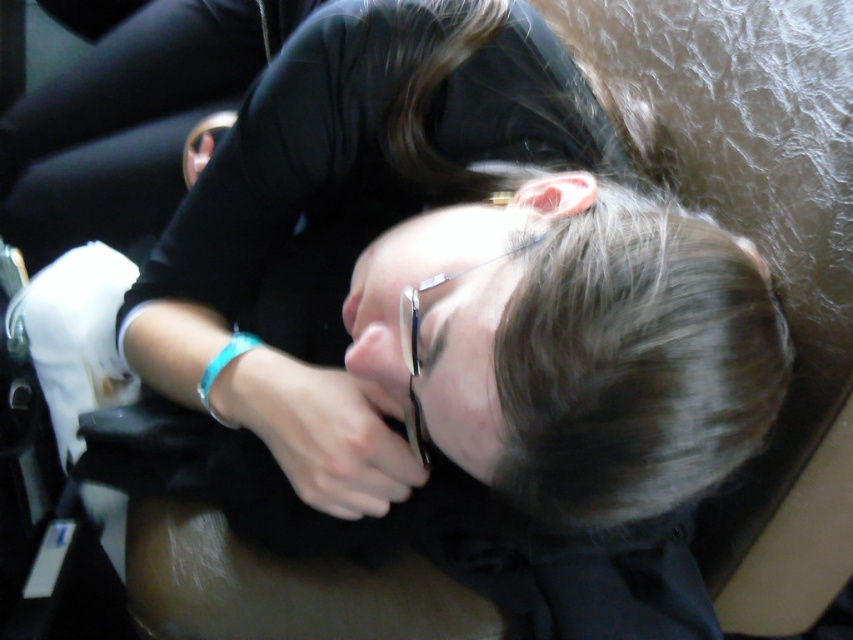
Does smooth skin hand at center come in front of turquoise plastic bracelet at lower center?

Yes, smooth skin hand at center is in front of turquoise plastic bracelet at lower center.

Can you confirm if smooth skin hand at center is thinner than turquoise plastic bracelet at lower center?

In fact, smooth skin hand at center might be wider than turquoise plastic bracelet at lower center.

Locate an element on the screen. This screenshot has height=640, width=853. smooth skin hand at center is located at coordinates (320, 432).

Can you confirm if dark brown silky hair at center is positioned to the right of smooth skin hand at center?

Indeed, dark brown silky hair at center is positioned on the right side of smooth skin hand at center.

Is point (579, 384) in front of point (306, 381)?

Yes, it is.

Is point (711, 365) positioned behind point (372, 509)?

No, it is not.

Locate an element on the screen. dark brown silky hair at center is located at coordinates (633, 362).

Is dark brown silky hair at center further to the viewer compared to turquoise plastic bracelet at lower center?

No.

The height and width of the screenshot is (640, 853). What do you see at coordinates (633, 362) in the screenshot?
I see `dark brown silky hair at center` at bounding box center [633, 362].

This screenshot has width=853, height=640. Find the location of `dark brown silky hair at center`. dark brown silky hair at center is located at coordinates (633, 362).